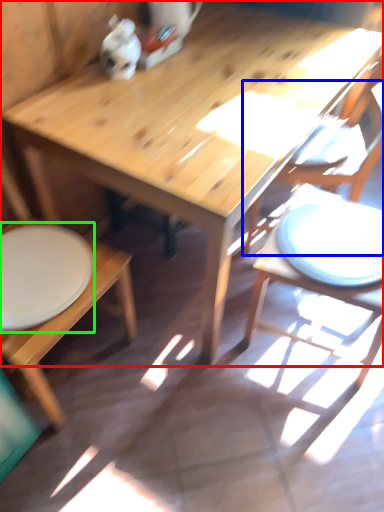
Question: Which object is the closest to the table (highlighted by a red box)? Choose among these: chair (highlighted by a blue box) or plate (highlighted by a green box).

Choices:
 (A) chair
 (B) plate

Answer: (B)